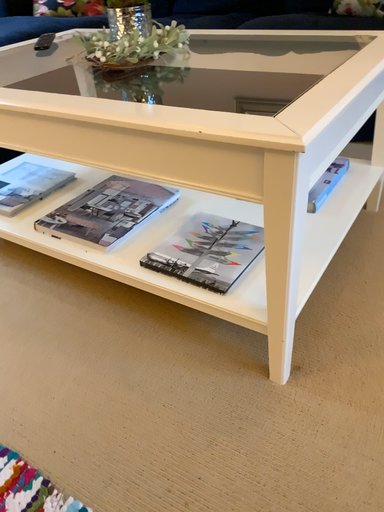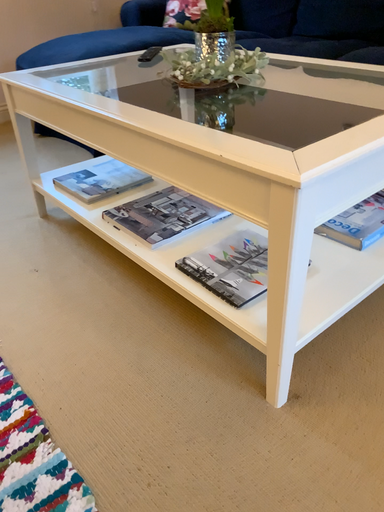
Question: Which way did the camera rotate in the video?

Choices:
 (A) rotated right
 (B) rotated left

Answer: (B)